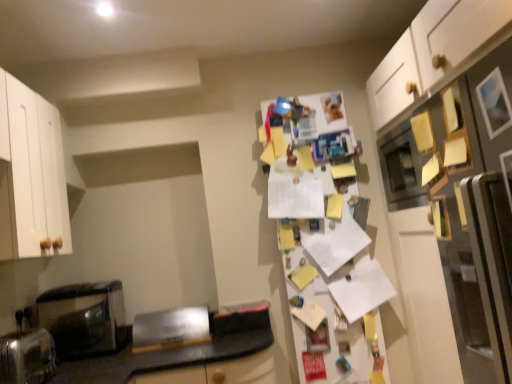
Question: Can we say white matte refrigerator at right, the first fridge positioned from the right, lies outside satin silver toaster at lower left, placed as the first appliance when sorted from front to back?

Choices:
 (A) yes
 (B) no

Answer: (A)

Question: Is white matte refrigerator at right, the second fridge when ordered from back to front, thinner than satin silver toaster at lower left, marked as the 2th appliance in a right-to-left arrangement?

Choices:
 (A) no
 (B) yes

Answer: (A)

Question: Considering the relative sizes of white matte refrigerator at right, the first fridge positioned from the right, and satin silver toaster at lower left, the first appliance viewed from the left, in the image provided, is white matte refrigerator at right, the first fridge positioned from the right, taller than satin silver toaster at lower left, the first appliance viewed from the left,?

Choices:
 (A) no
 (B) yes

Answer: (B)

Question: Can you confirm if white matte refrigerator at right, which appears as the first fridge when viewed from the front, is bigger than satin silver toaster at lower left, the first appliance viewed from the left?

Choices:
 (A) no
 (B) yes

Answer: (B)

Question: Is white matte refrigerator at right, the first fridge positioned from the right, further to the viewer compared to satin silver toaster at lower left, arranged as the second appliance when viewed from the back?

Choices:
 (A) no
 (B) yes

Answer: (A)

Question: From the image's perspective, is white matte refrigerator at right, the second fridge when ordered from back to front, located above satin silver toaster at lower left, placed as the first appliance when sorted from front to back?

Choices:
 (A) no
 (B) yes

Answer: (B)

Question: Is white matte refrigerator at right, the second fridge in the left-to-right sequence, in front of white paper covered fridge at center, acting as the second fridge starting from the front?

Choices:
 (A) no
 (B) yes

Answer: (B)

Question: Does white matte refrigerator at right, the second fridge in the left-to-right sequence, have a larger size compared to white paper covered fridge at center, the 2th fridge from the right?

Choices:
 (A) no
 (B) yes

Answer: (B)

Question: From a real-world perspective, is white matte refrigerator at right, which appears as the first fridge when viewed from the front, under white paper covered fridge at center, acting as the second fridge starting from the front?

Choices:
 (A) yes
 (B) no

Answer: (A)

Question: Would you say white paper covered fridge at center, which ranks as the 1th fridge in back-to-front order, is part of white matte refrigerator at right, the second fridge in the left-to-right sequence,'s contents?

Choices:
 (A) yes
 (B) no

Answer: (B)

Question: Does white matte refrigerator at right, the first fridge positioned from the right, have a greater height compared to white paper covered fridge at center, the 2th fridge from the right?

Choices:
 (A) no
 (B) yes

Answer: (A)

Question: From the image's perspective, is white matte refrigerator at right, the second fridge in the left-to-right sequence, located above white paper covered fridge at center, acting as the second fridge starting from the front?

Choices:
 (A) yes
 (B) no

Answer: (A)

Question: Considering the relative sizes of black glossy microwave at left and brushed metal toaster at lower left, the 2th appliance viewed from the left, in the image provided, is black glossy microwave at left taller than brushed metal toaster at lower left, the 2th appliance viewed from the left,?

Choices:
 (A) no
 (B) yes

Answer: (B)